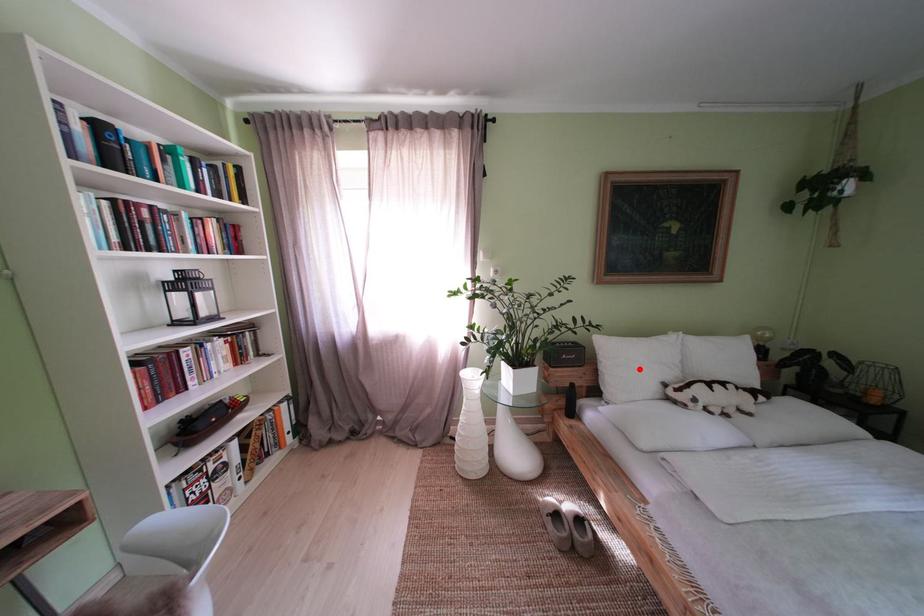
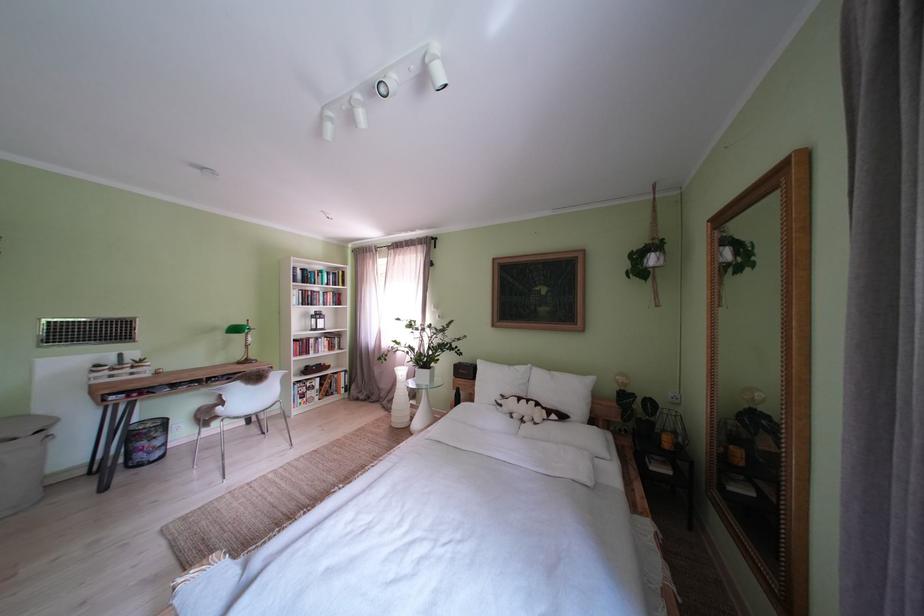
Question: I am providing you with two images of the same scene from different viewpoints. A red point is marked on the first image. At the location where the point appears in image 1, is it still visible in image 2?

Choices:
 (A) Yes
 (B) No

Answer: (A)